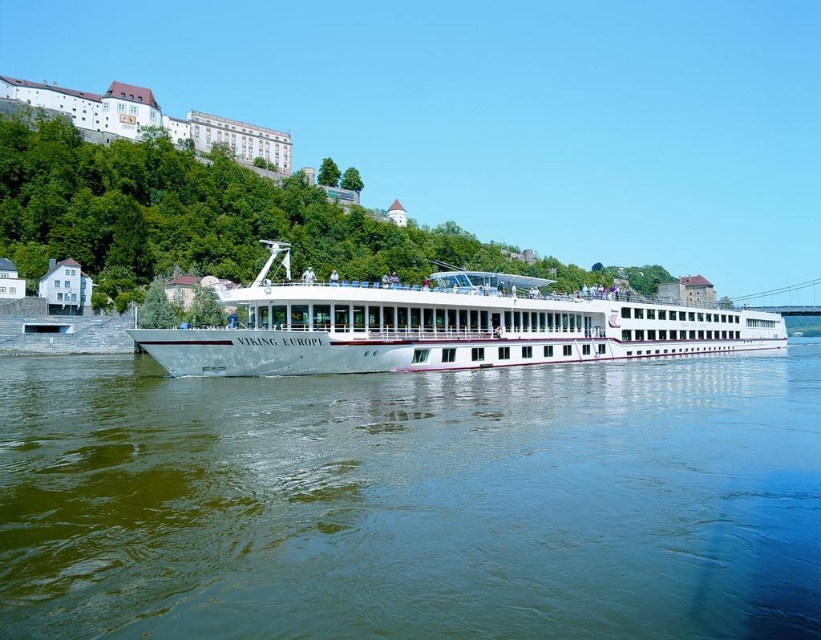
Question: Which point is farther to the camera?

Choices:
 (A) (345, 579)
 (B) (166, 337)

Answer: (B)

Question: Can you confirm if greenish water at center is positioned to the left of white glossy cruise ship at center?

Choices:
 (A) no
 (B) yes

Answer: (A)

Question: Is greenish water at center positioned before white glossy cruise ship at center?

Choices:
 (A) no
 (B) yes

Answer: (B)

Question: Which of the following is the farthest from the observer?

Choices:
 (A) white glossy cruise ship at center
 (B) greenish water at center

Answer: (A)

Question: Does greenish water at center appear under white glossy cruise ship at center?

Choices:
 (A) yes
 (B) no

Answer: (A)